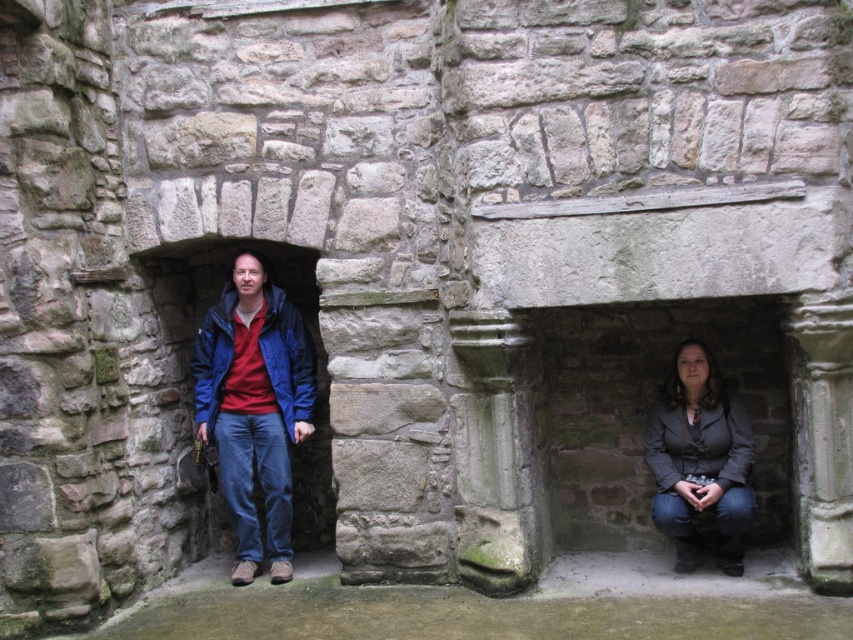
Does point (714, 468) lie behind point (297, 360)?

No, (714, 468) is closer to viewer.

Is the position of dark gray textured jacket at lower right more distant than that of blue fabric jacket at center?

No.

Where is `dark gray textured jacket at lower right`? dark gray textured jacket at lower right is located at coordinates (699, 460).

Identify the location of dark gray textured jacket at lower right. The image size is (853, 640). (699, 460).

The height and width of the screenshot is (640, 853). I want to click on blue fabric jacket at center, so click(287, 358).

Is dark gray textured jacket at lower right smaller than dark gray matte jacket at lower right?

Incorrect, dark gray textured jacket at lower right is not smaller in size than dark gray matte jacket at lower right.

The image size is (853, 640). What are the coordinates of `dark gray textured jacket at lower right` in the screenshot? It's located at (699, 460).